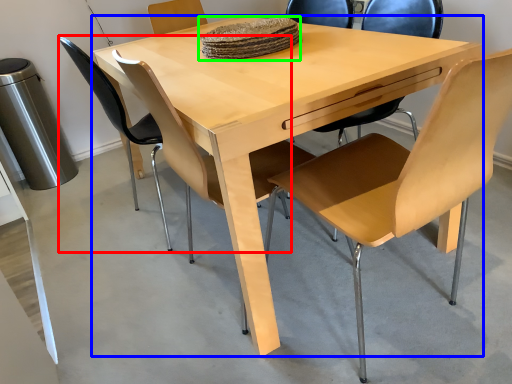
Question: Based on their relative distances, which object is farther from chair (highlighted by a red box)? Choose from table (highlighted by a blue box) and food (highlighted by a green box).

Choices:
 (A) table
 (B) food

Answer: (B)